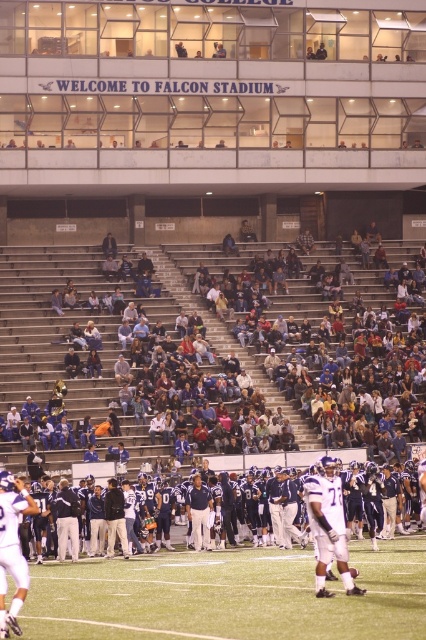
Is blue fabric seats at center to the left of green turf at center from the viewer's perspective?

Incorrect, blue fabric seats at center is not on the left side of green turf at center.

Between blue fabric seats at center and green turf at center, which one appears on the left side from the viewer's perspective?

From the viewer's perspective, green turf at center appears more on the left side.

This screenshot has width=426, height=640. Identify the location of blue fabric seats at center. (218, 346).